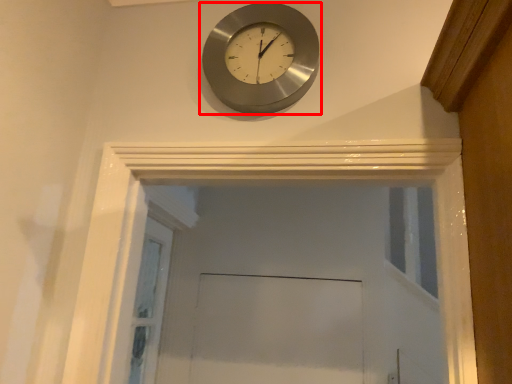
Question: From the image's perspective, where is wall clock (annotated by the red box) located relative to screen door?

Choices:
 (A) above
 (B) below

Answer: (A)